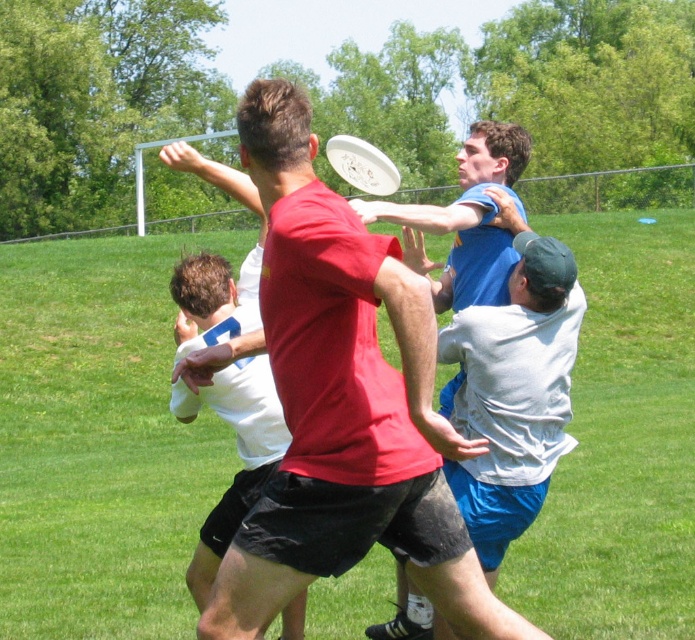
Which of these two, green grass at center or white plastic frisbee at center, stands shorter?

With less height is green grass at center.

Who is more forward, (x=587, y=234) or (x=351, y=176)?

Point (x=351, y=176)

You are a GUI agent. You are given a task and a screenshot of the screen. Output one action in this format:
    pyautogui.click(x=<x>, y=<y>)
    Task: Click on the green grass at center
    This screenshot has height=640, width=695.
    Given the screenshot: What is the action you would take?
    (x=99, y=440)

Which of these two, blue jersey at center or white plastic frisbee at center, stands shorter?

blue jersey at center is shorter.

Does point (482, 243) lie behind point (351, 179)?

No.

Describe the element at coordinates (471, 218) in the screenshot. The width and height of the screenshot is (695, 640). I see `blue jersey at center` at that location.

Locate an element on the screen. The height and width of the screenshot is (640, 695). blue jersey at center is located at coordinates (471, 218).

Consider the image. Can you confirm if green grass at center is positioned to the left of blue jersey at center?

Indeed, green grass at center is positioned on the left side of blue jersey at center.

Which is in front, point (685, 388) or point (477, 300)?

Point (477, 300) is in front.

I want to click on green grass at center, so click(99, 440).